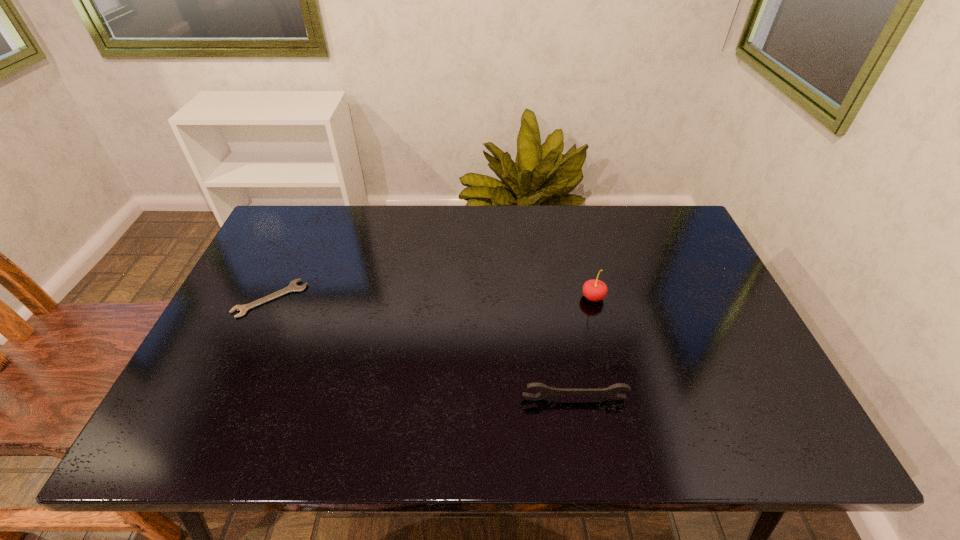
This screenshot has width=960, height=540. I want to click on vacant area that lies between the taller wrench and the farther wrench, so coord(422,349).

Identify the location of unoccupied area between the leftmost object and the second shortest object. 422,349.

At what (x,y) coordinates should I click in order to perform the action: click on object that is the closest to the cherry. Please return your answer as a coordinate pair (x, y). The height and width of the screenshot is (540, 960). Looking at the image, I should click on (611, 392).

You are a GUI agent. You are given a task and a screenshot of the screen. Output one action in this format:
    pyautogui.click(x=<x>, y=<y>)
    Task: Click on the object that is the second closest to the cherry
    
    Given the screenshot: What is the action you would take?
    pyautogui.click(x=293, y=287)